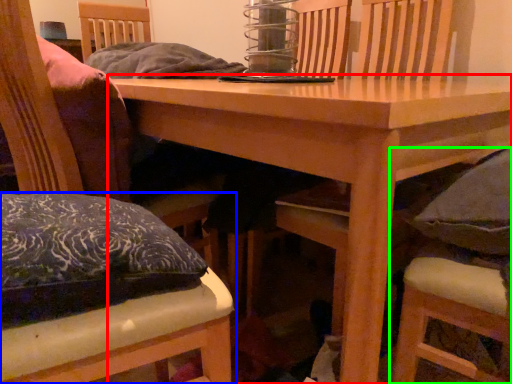
Question: Estimate the real-world distances between objects in this image. Which object is closer to table (highlighted by a red box), chair (highlighted by a blue box) or chair (highlighted by a green box)?

Choices:
 (A) chair
 (B) chair

Answer: (B)